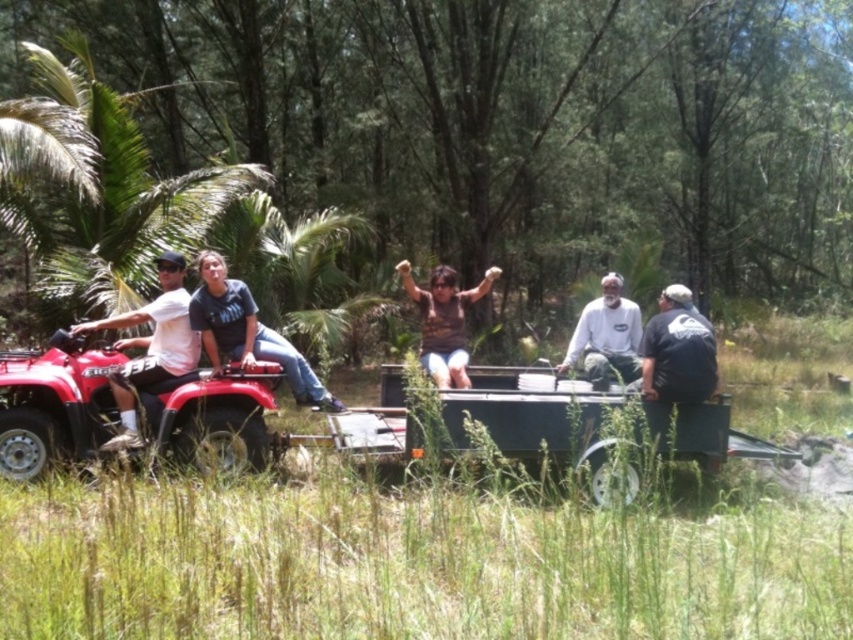
You are a photographer trying to capture a group photo of the two people on the ATV and the three on the trailer. The camera you have can only focus on objects within a 3 meter range. The distance between the white matte shirt on the left and the black matte shirt at right is 2.5 meters. Can you fit everyone in the frame without moving the camera?

The distance between the white matte shirt on the left and the black matte shirt at right is 2.5 meters, which is within the camera focus range of 3 meters. Therefore, you can fit everyone in the frame without moving the camera.

You are a photographer trying to capture a group photo of the scene. The camera you are using has a rectangular frame with coordinates ranging from 0 to 1 on both axes. You want to ensure that the white matte shirt on the left is centered in the frame. What should be the coordinates of the center of the frame to achieve this?

The white matte shirt on the left is located at point coordinates of (x=149, y=346). To center it in the frame, the center of the frame should be set to the same coordinates, so the center coordinates would be (x=149, y=346).

Consider the image. You are a photographer taking a picture of the group. You notice the white matte shirt on the left. Where exactly should you focus your camera to capture it perfectly?

The white matte shirt on the left is located at point (149, 346), so you should focus your camera at those coordinates to capture it perfectly.